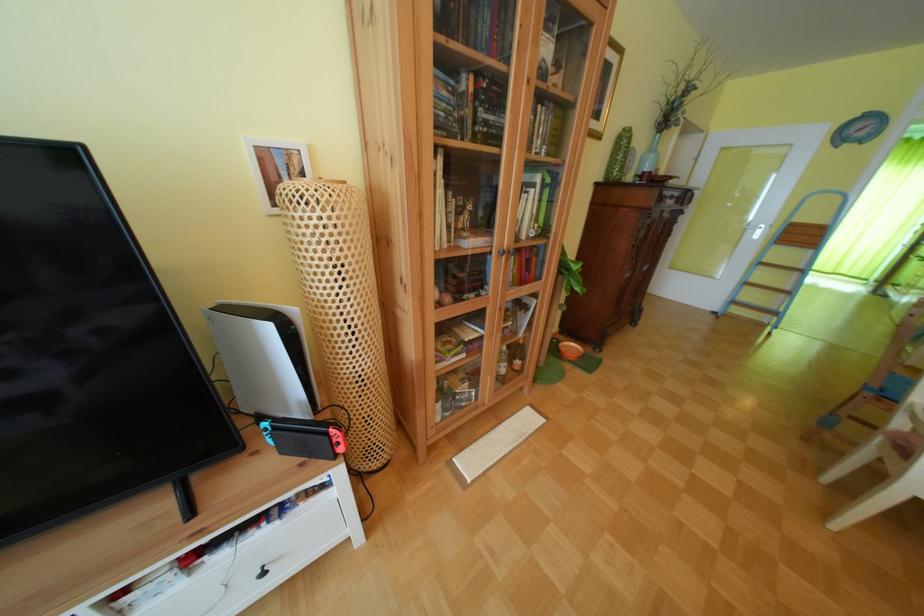
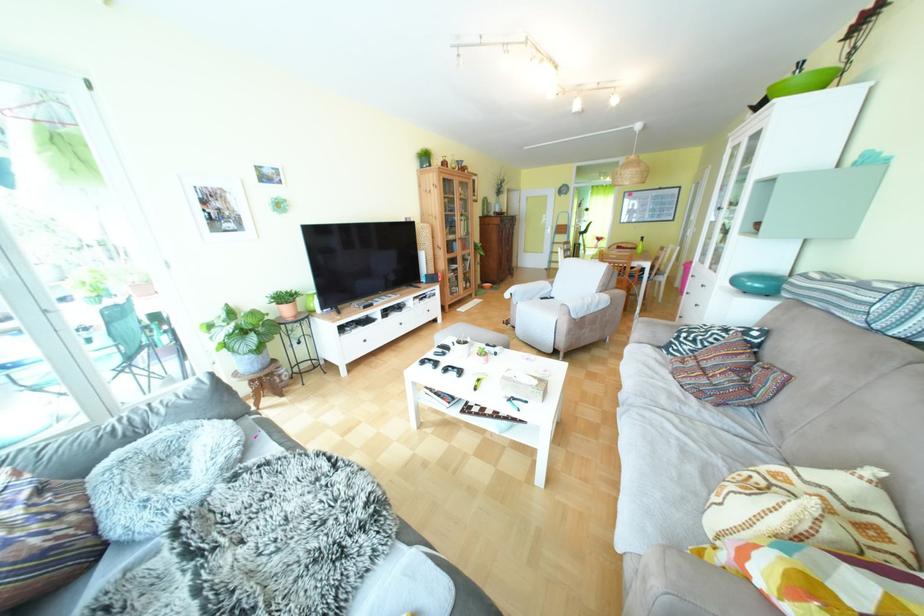
What movement of the cameraman would produce the second image?

The cameraman walked toward left, backward.